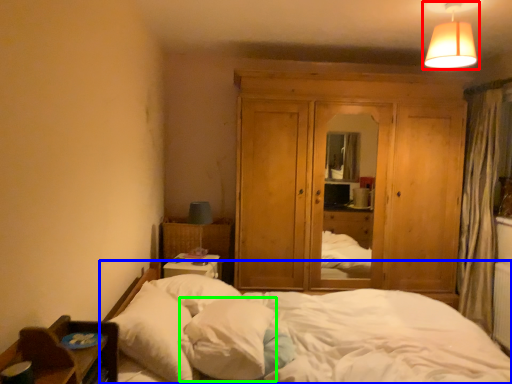
Question: Which object is positioned farthest from lamp (highlighted by a red box)? Select from bed (highlighted by a blue box) and pillow (highlighted by a green box).

Choices:
 (A) bed
 (B) pillow

Answer: (B)